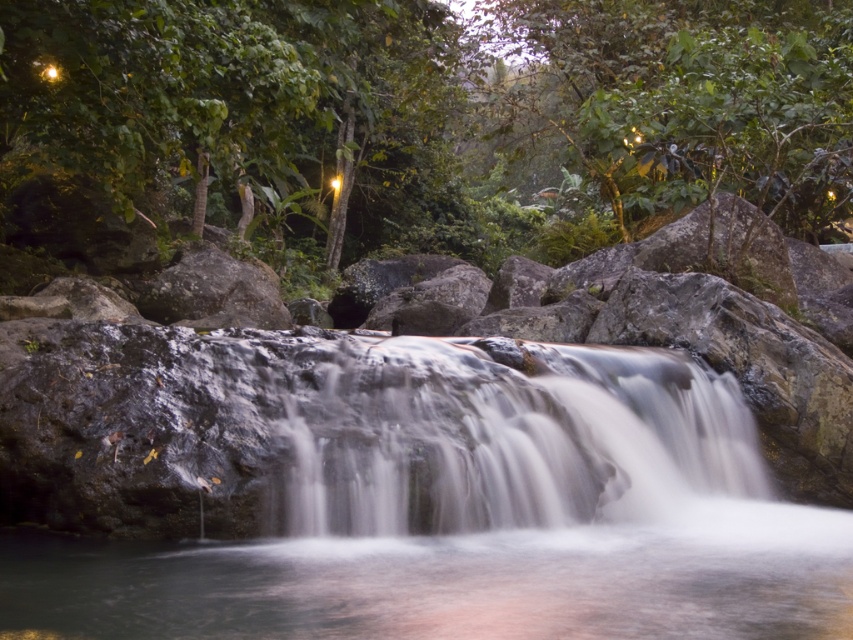
You are standing in front of the waterfall scene. You want to touch the smooth rock waterfall at center and the smooth white water at center. Which one can you reach first without moving your position?

The smooth rock waterfall at center is closer to the viewer than the smooth white water at center, so you can reach the smooth rock waterfall at center first.

You are a photographer planning to capture the waterfall. You notice two distinct areas of water in the scene. Which area of water, the clear water at center or the smooth white water at center, would you focus on if you want to highlight the smaller portion of the waterfall?

The clear water at center is smaller than the smooth white water at center, so focusing on the clear water at center would highlight the smaller portion of the waterfall.

You are standing at the edge of the waterfall and want to cross to the other side. The clear water at center flows from the left to the right. Which direction should you walk to avoid the strongest current?

The clear water at center flows from the left to the right, so to avoid the strongest current, you should walk upstream towards the left side of the waterfall.